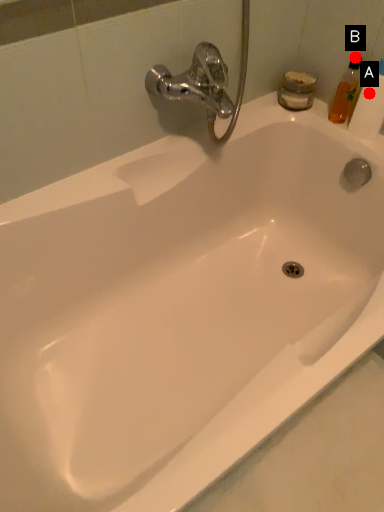
Question: Two points are circled on the image, labeled by A and B beside each circle. Which point is closer to the camera?

Choices:
 (A) A is closer
 (B) B is closer

Answer: (A)